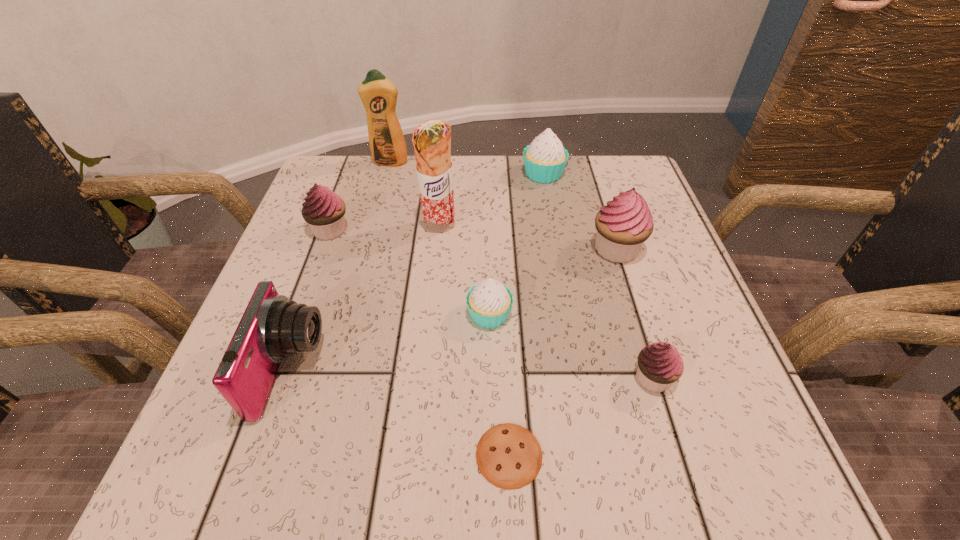
At what (x,y) coordinates should I click in order to perform the action: click on the nearest cupcake. Please return your answer as a coordinate pair (x, y). The width and height of the screenshot is (960, 540). Looking at the image, I should click on pyautogui.click(x=659, y=364).

Image resolution: width=960 pixels, height=540 pixels. In order to click on the second cupcake from left to right in this screenshot , I will do `click(489, 302)`.

In order to click on the fourth farthest cupcake in this screenshot , I will do `click(489, 302)`.

The image size is (960, 540). Identify the location of cookie. (509, 456).

Identify the location of blank area located on the label of the detergent. The height and width of the screenshot is (540, 960). (376, 214).

The height and width of the screenshot is (540, 960). I want to click on vacant space situated on the right of the burrito, so click(x=535, y=227).

Where is `vacant space situated on the left of the tallest cupcake`? vacant space situated on the left of the tallest cupcake is located at coordinates (492, 249).

Locate an element on the screen. The height and width of the screenshot is (540, 960). vacant point located on the front of the bigger white cupcake is located at coordinates (564, 293).

Find the location of `free space located on the right of the leftmost cupcake`. free space located on the right of the leftmost cupcake is located at coordinates (449, 230).

Locate an element on the screen. The height and width of the screenshot is (540, 960). vacant space located 0.060m on the front-facing side of the camera is located at coordinates (356, 370).